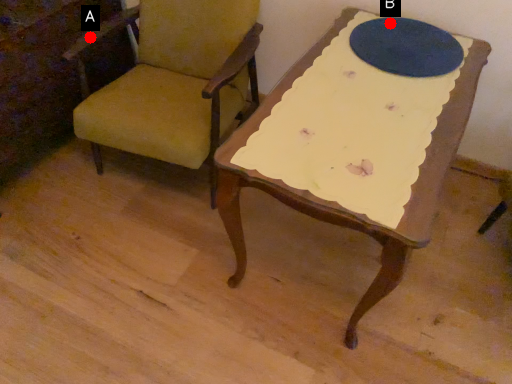
Question: Two points are circled on the image, labeled by A and B beside each circle. Which point is farther to the camera?

Choices:
 (A) A is further
 (B) B is further

Answer: (A)